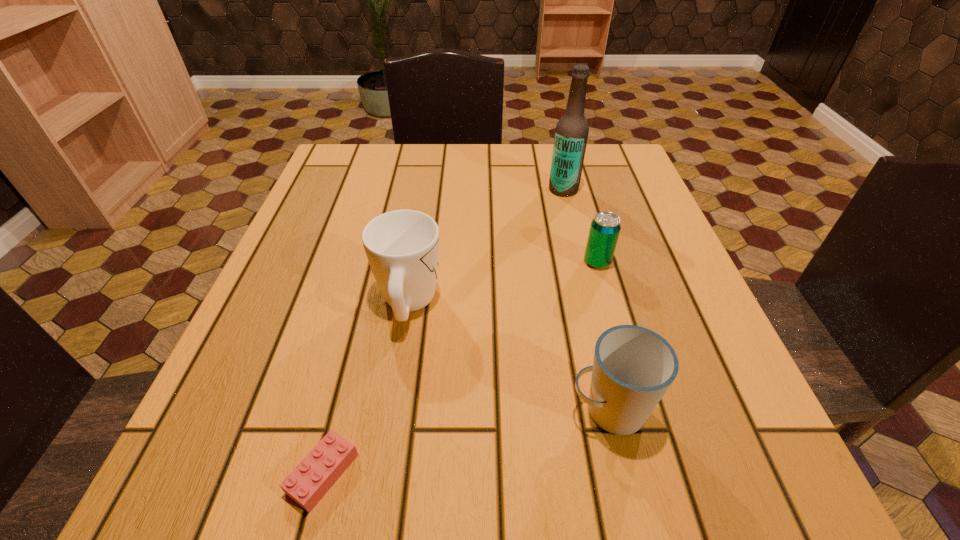
This screenshot has height=540, width=960. Find the location of `vacant region located 0.380m on the side of the mug with the handle`. vacant region located 0.380m on the side of the mug with the handle is located at coordinates point(430,167).

The image size is (960, 540). I want to click on free location located 0.310m on the side of the mug with the handle, so click(428, 182).

Identify the location of free space located on the side of the mug with the handle. The width and height of the screenshot is (960, 540). (422, 214).

Where is `free location located with a handle on the side of the cup`? The height and width of the screenshot is (540, 960). free location located with a handle on the side of the cup is located at coordinates (433, 410).

Find the location of a particular element. vacant region located with a handle on the side of the cup is located at coordinates (341, 410).

The height and width of the screenshot is (540, 960). I want to click on free spot located with a handle on the side of the cup, so point(383,410).

I want to click on vacant space located on the back of the fourth nearest object, so click(566, 152).

Identify the location of free space located on the right of the shortest object. (466, 474).

Image resolution: width=960 pixels, height=540 pixels. In order to click on object at the far edge in this screenshot , I will do `click(571, 134)`.

Identify the location of cup present at the near edge. [633, 367].